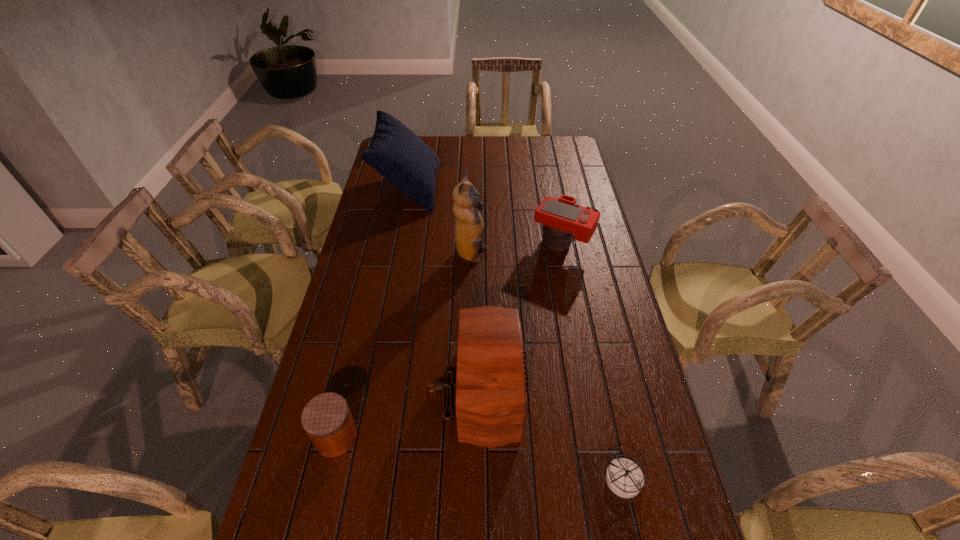
Identify which object is located as the second nearest to the jar. Please provide its 2D coordinates. Your answer should be formatted as a tuple, i.e. [(x, y)], where the tuple contains the x and y coordinates of a point satisfying the conditions above.

[(624, 477)]

Locate an element on the screen. The height and width of the screenshot is (540, 960). object that is the closest one to the cat is located at coordinates (562, 217).

Image resolution: width=960 pixels, height=540 pixels. In order to click on vacant point that satisfies the following two spatial constraints: 1. on the back side of the compass; 2. on the front-facing side of the third tallest object in this screenshot , I will do `click(605, 390)`.